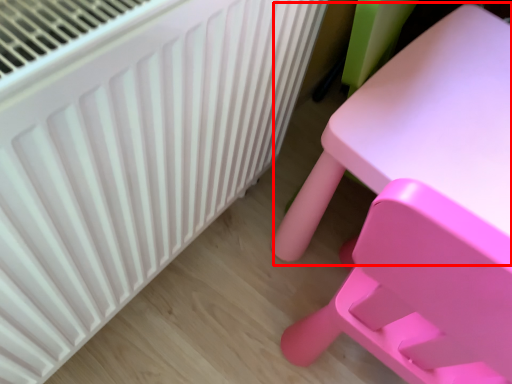
Question: From the image, what is the correct spatial relationship of table (annotated by the red box) in relation to radiator?

Choices:
 (A) right
 (B) left

Answer: (A)